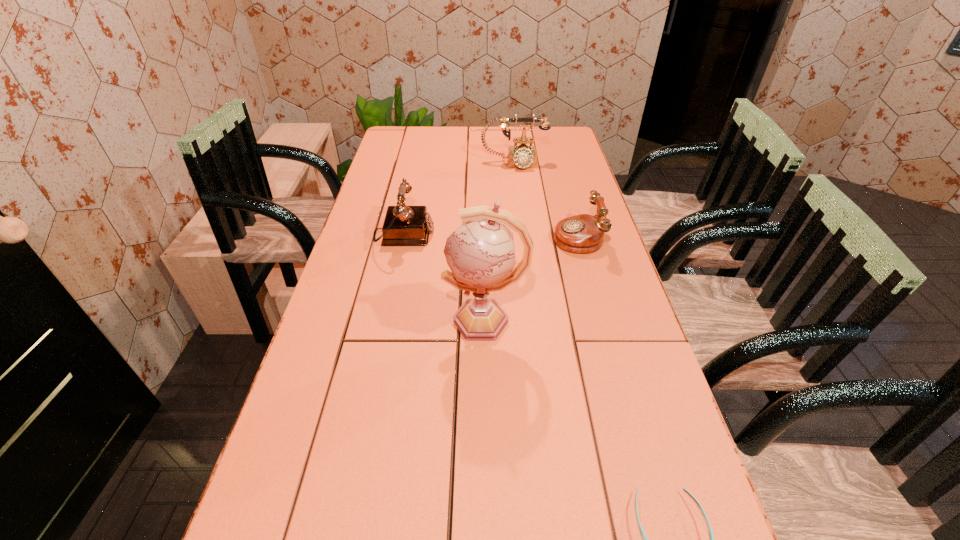
This screenshot has height=540, width=960. Identify the location of the tallest object. (480, 253).

Locate an element on the screen. The image size is (960, 540). globe is located at coordinates (480, 253).

Image resolution: width=960 pixels, height=540 pixels. I want to click on the farthest telephone, so pyautogui.click(x=522, y=156).

This screenshot has width=960, height=540. I want to click on the farthest object, so click(x=522, y=156).

The height and width of the screenshot is (540, 960). I want to click on the leftmost object, so click(403, 225).

Find the location of `vacant position located on the front-facing side of the globe`. vacant position located on the front-facing side of the globe is located at coordinates (380, 321).

Find the location of `free space located on the front-facing side of the globe`. free space located on the front-facing side of the globe is located at coordinates (384, 321).

You are a GUI agent. You are given a task and a screenshot of the screen. Output one action in this format:
    pyautogui.click(x=<x>, y=<y>)
    Task: Click on the vacant point located on the front-facing side of the globe
    
    Given the screenshot: What is the action you would take?
    pyautogui.click(x=400, y=321)

Find the location of a particular element. This screenshot has height=540, width=960. vacant space located 0.050m on the dial number of the farthest object is located at coordinates (516, 178).

This screenshot has height=540, width=960. What are the coordinates of `vacant area located on the dial of the leftmost object` in the screenshot? It's located at (546, 235).